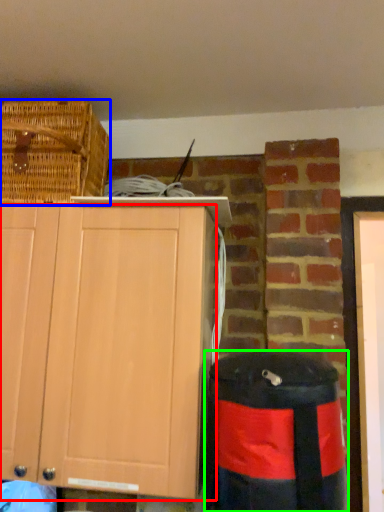
Question: Which object is the closest to the cabinetry (highlighted by a red box)? Choose among these: picnic basket (highlighted by a blue box) or trash bin/can (highlighted by a green box).

Choices:
 (A) picnic basket
 (B) trash bin/can

Answer: (B)